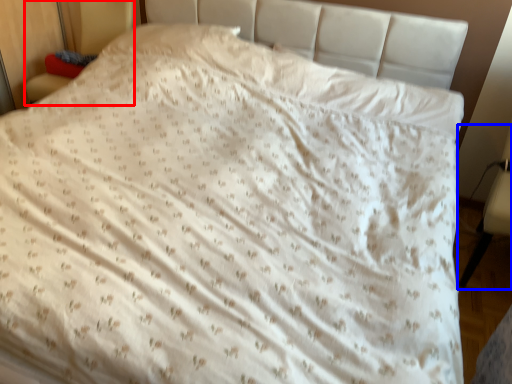
Question: Which object is closer to the camera taking this photo, armchair (highlighted by a red box) or armchair (highlighted by a blue box)?

Choices:
 (A) armchair
 (B) armchair

Answer: (B)